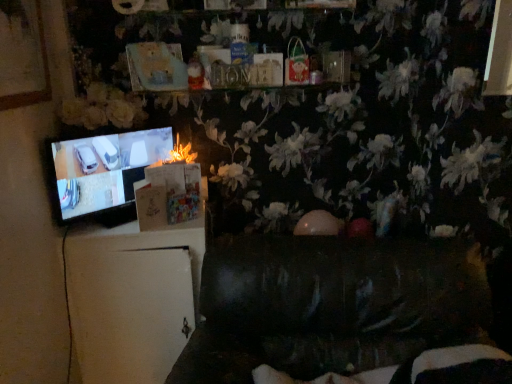
Question: Would you say dark leather couch at lower center is part of fluffy paper at center's contents?

Choices:
 (A) yes
 (B) no

Answer: (B)

Question: Is fluffy paper at center positioned with its back to dark leather couch at lower center?

Choices:
 (A) yes
 (B) no

Answer: (B)

Question: Can you confirm if fluffy paper at center is thinner than dark leather couch at lower center?

Choices:
 (A) yes
 (B) no

Answer: (A)

Question: Can you confirm if fluffy paper at center is positioned to the right of dark leather couch at lower center?

Choices:
 (A) yes
 (B) no

Answer: (B)

Question: Does fluffy paper at center have a lesser height compared to dark leather couch at lower center?

Choices:
 (A) no
 (B) yes

Answer: (B)

Question: From a real-world perspective, is black glossy television at left physically located above or below fluffy paper at center?

Choices:
 (A) below
 (B) above

Answer: (A)

Question: Considering their positions, is black glossy television at left located in front of or behind fluffy paper at center?

Choices:
 (A) behind
 (B) front

Answer: (B)

Question: Is point (96, 185) positioned closer to the camera than point (196, 155)?

Choices:
 (A) farther
 (B) closer

Answer: (B)

Question: Looking at their shapes, would you say black glossy television at left is wider or thinner than fluffy paper at center?

Choices:
 (A) wide
 (B) thin

Answer: (B)

Question: Is fluffy paper at center in front of or behind dark leather couch at lower center in the image?

Choices:
 (A) front
 (B) behind

Answer: (B)

Question: Is fluffy paper at center bigger or smaller than dark leather couch at lower center?

Choices:
 (A) big
 (B) small

Answer: (B)

Question: Considering the relative positions of fluffy paper at center and dark leather couch at lower center in the image provided, is fluffy paper at center to the left or to the right of dark leather couch at lower center?

Choices:
 (A) left
 (B) right

Answer: (A)

Question: In terms of height, does fluffy paper at center look taller or shorter compared to dark leather couch at lower center?

Choices:
 (A) short
 (B) tall

Answer: (A)

Question: Considering their positions, is dark leather couch at lower center located in front of or behind black glossy television at left?

Choices:
 (A) front
 (B) behind

Answer: (A)

Question: From the image's perspective, relative to black glossy television at left, is dark leather couch at lower center above or below?

Choices:
 (A) below
 (B) above

Answer: (A)